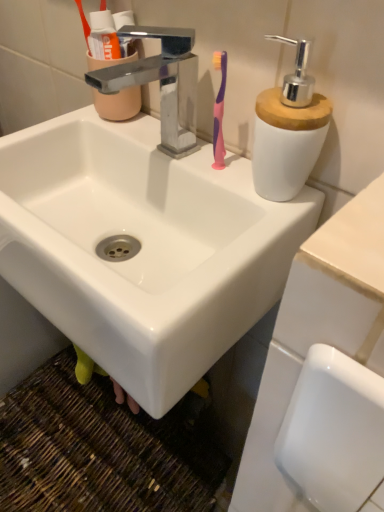
You are a GUI agent. You are given a task and a screenshot of the screen. Output one action in this format:
    pyautogui.click(x=<x>, y=<y>)
    Task: Click on the vacant space to the right of satin nickel faucet at center
    
    Given the screenshot: What is the action you would take?
    pyautogui.click(x=219, y=175)